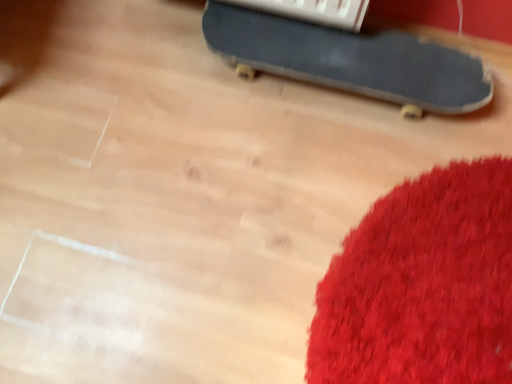
The image size is (512, 384). Identify the location of vacant space that is to the left of smooth black skateboard at upper right. (158, 110).